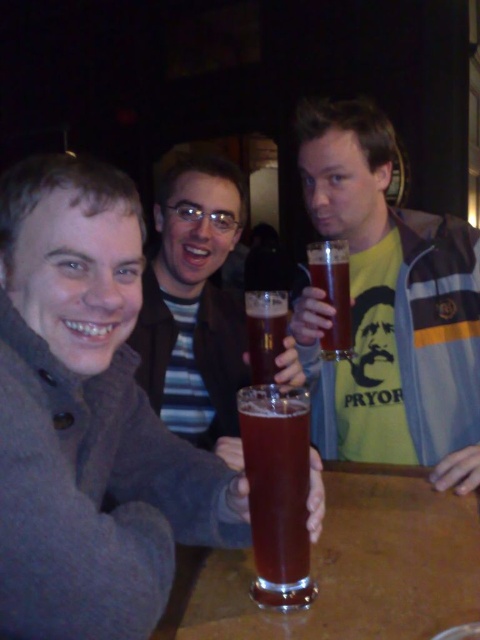
Between translucent glass mug at center and translucent glass beer at center, which one is positioned higher?

Positioned higher is translucent glass beer at center.

This screenshot has width=480, height=640. I want to click on translucent glass mug at center, so click(x=276, y=480).

Which is behind, point (274, 481) or point (264, 310)?

The point (264, 310) is behind.

This screenshot has width=480, height=640. In order to click on translucent glass mug at center in this screenshot , I will do `click(276, 480)`.

Between matte brown jacket at left and translucent glass mug at center, which one is positioned lower?

translucent glass mug at center is below.

Which is more to the left, matte brown jacket at left or translucent glass mug at center?

matte brown jacket at left is more to the left.

Is point (43, 385) closer to viewer compared to point (249, 484)?

No, it is behind (249, 484).

Locate an element on the screen. This screenshot has height=640, width=480. matte brown jacket at left is located at coordinates (87, 419).

Which of these two, matte brown jacket at center or translucent glass mug at center, stands shorter?

Standing shorter between the two is translucent glass mug at center.

Is point (149, 289) in front of point (278, 428)?

No, it is behind (278, 428).

Measure the distance between matte brown jacket at center and camera.

matte brown jacket at center is 92.60 centimeters away from camera.

Find the location of a particular element. This screenshot has width=480, height=640. matte brown jacket at center is located at coordinates (194, 307).